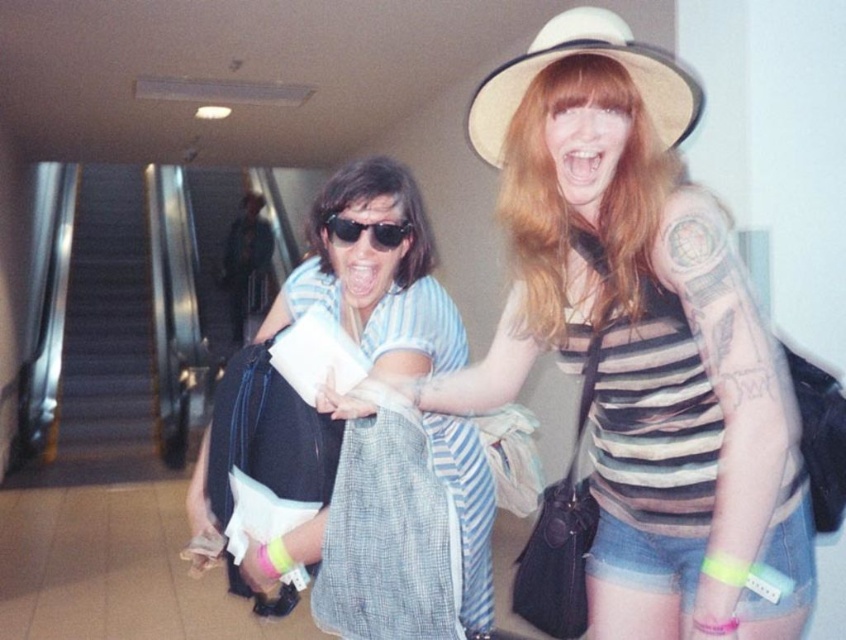
Question: Considering the real-world distances, which object is closest to the matte black sunglasses at center?

Choices:
 (A) black metal escalator at left
 (B) blue striped shirt at center
 (C) striped fabric shirt at center
 (D) white straw hat at upper center

Answer: (B)

Question: Which object is the closest to the blue striped shirt at center?

Choices:
 (A) black metal escalator at left
 (B) matte black sunglasses at center

Answer: (B)

Question: Which point is closer to the camera taking this photo?

Choices:
 (A) (397, 236)
 (B) (92, 250)

Answer: (A)

Question: Is striped fabric shirt at center below black metal escalator at left?

Choices:
 (A) no
 (B) yes

Answer: (B)

Question: Does blue striped shirt at center have a greater width compared to white straw hat at upper center?

Choices:
 (A) no
 (B) yes

Answer: (B)

Question: Can you confirm if black metal escalator at left is smaller than matte black sunglasses at center?

Choices:
 (A) yes
 (B) no

Answer: (B)